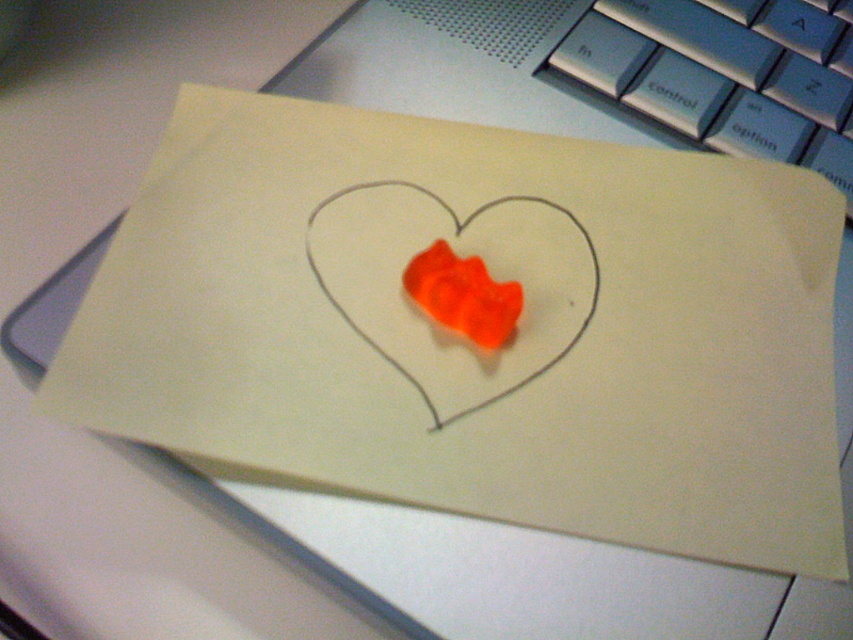
Question: Which point is closer to the camera?

Choices:
 (A) [x=468, y=332]
 (B) [x=585, y=310]

Answer: (A)

Question: Does orange gelatinous heart at center appear under translucent orange gummy bear at center?

Choices:
 (A) yes
 (B) no

Answer: (B)

Question: Does orange gelatinous heart at center appear on the left side of translucent orange gummy bear at center?

Choices:
 (A) yes
 (B) no

Answer: (A)

Question: Considering the relative positions of orange gelatinous heart at center and translucent orange gummy bear at center in the image provided, where is orange gelatinous heart at center located with respect to translucent orange gummy bear at center?

Choices:
 (A) above
 (B) below

Answer: (A)

Question: Which point appears farthest from the camera in this image?

Choices:
 (A) (310, 260)
 (B) (425, 250)

Answer: (A)